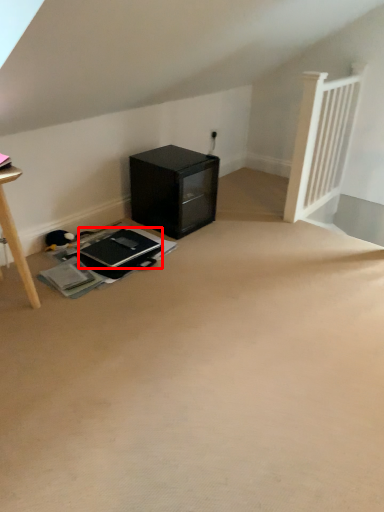
Question: From the image's perspective, what is the correct spatial positioning of laptop (annotated by the red box) in reference to furniture?

Choices:
 (A) below
 (B) above

Answer: (A)